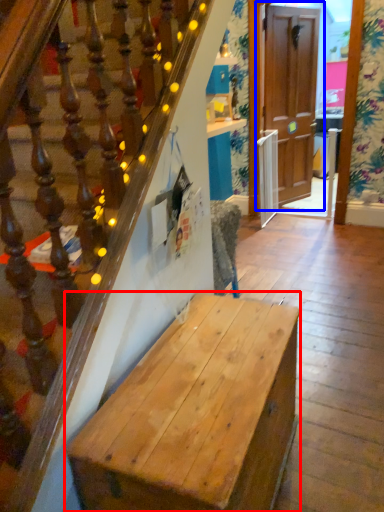
Question: Which object appears farthest to the camera in this image, desk (highlighted by a red box) or door (highlighted by a blue box)?

Choices:
 (A) desk
 (B) door

Answer: (B)